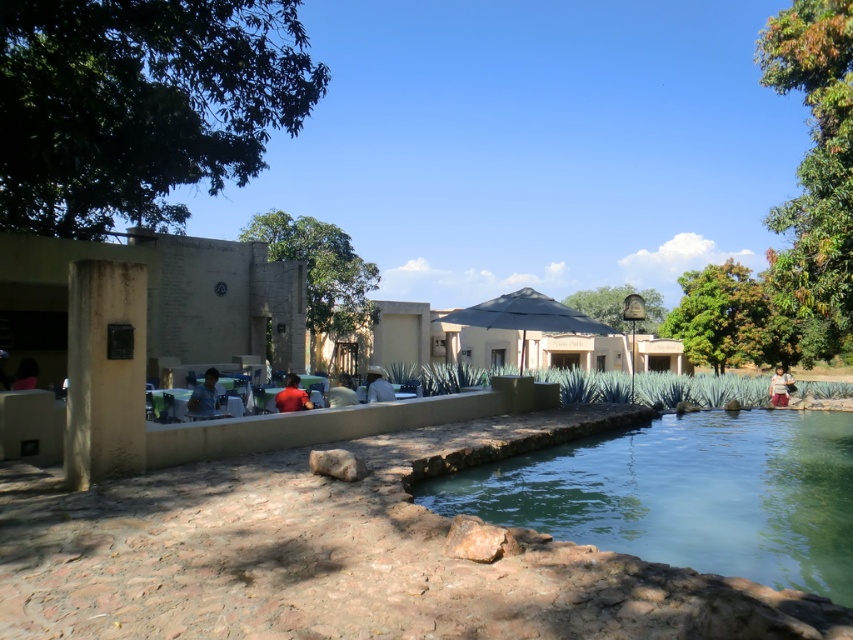
You are a guest at this outdoor space and want to walk from the paved area to the blue denim jeans at right. Is the clear glass pool at center in your path?

Yes, the clear glass pool at center is in your path because it is located in front of the blue denim jeans at right, meaning you would have to walk past or around it to reach the jeans.

You are planning to place a decorative statue that is 1.2 meters wide between the clear glass pool at center and the blue denim jeans at right. Based on their widths, will the statue fit between them without overlapping?

The clear glass pool at center has a lesser width compared to blue denim jeans at right. Since the statue is 1.2 meters wide, and the total available space between them would depend on their widths and positioning, but since the pool is narrower, the combined space might accommodate the statue. However, without exact measurements of the distance between them, we cannot confirm for certain. The answer is inconclusive based on the given information.